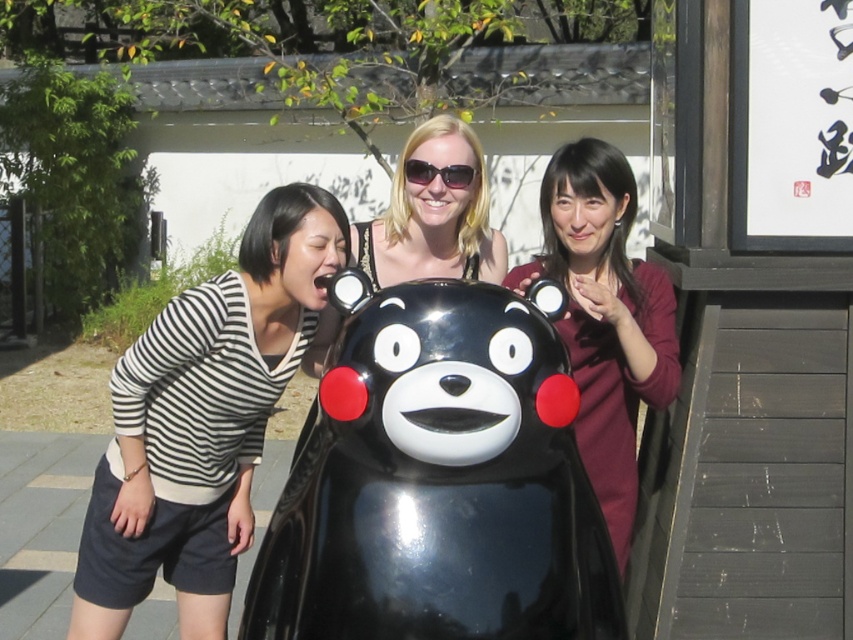
Question: Which object is positioned farthest from the glossy black bear at center?

Choices:
 (A) maroon sweater at right
 (B) striped fabric shirt at left

Answer: (B)

Question: Is the position of glossy black bear at center more distant than that of striped fabric shirt at left?

Choices:
 (A) yes
 (B) no

Answer: (B)

Question: Which point is closer to the camera?

Choices:
 (A) glossy black bear at center
 (B) maroon sweater at right
 (C) striped fabric shirt at left

Answer: (A)

Question: Does striped fabric shirt at left appear on the right side of maroon sweater at right?

Choices:
 (A) no
 (B) yes

Answer: (A)

Question: Does striped fabric shirt at left appear on the left side of maroon sweater at right?

Choices:
 (A) no
 (B) yes

Answer: (B)

Question: Which point is closer to the camera taking this photo?

Choices:
 (A) (88, 586)
 (B) (554, 541)
 (C) (648, 358)

Answer: (B)